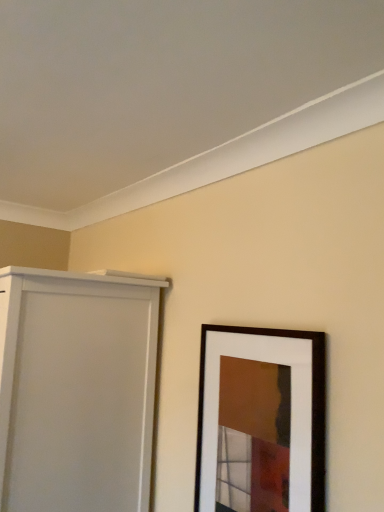
Find the location of a particular element. The height and width of the screenshot is (512, 384). white matte door at left is located at coordinates (76, 390).

The height and width of the screenshot is (512, 384). Describe the element at coordinates (76, 390) in the screenshot. I see `white matte door at left` at that location.

What are the coordinates of `wooden picture frame at lower right` in the screenshot? It's located at (261, 421).

In order to face wooden picture frame at lower right, should I rotate leftwards or rightwards?

A 7.708 degree turn to the right will do.

This screenshot has width=384, height=512. What do you see at coordinates (261, 421) in the screenshot?
I see `wooden picture frame at lower right` at bounding box center [261, 421].

Find the location of a particular element. This screenshot has width=384, height=512. white matte door at left is located at coordinates (76, 390).

Does white matte door at left appear on the left side of wooden picture frame at lower right?

Indeed, white matte door at left is positioned on the left side of wooden picture frame at lower right.

Is white matte door at left further to camera compared to wooden picture frame at lower right?

Yes, white matte door at left is further from the camera.

Considering the positions of points (57, 347) and (198, 508), is point (57, 347) closer to camera compared to point (198, 508)?

That is False.

From the image's perspective, which is below, white matte door at left or wooden picture frame at lower right?

white matte door at left, from the image's perspective.

From a real-world perspective, does white matte door at left sit lower than wooden picture frame at lower right?

Yes, from a real-world perspective, white matte door at left is under wooden picture frame at lower right.

Which of these two, white matte door at left or wooden picture frame at lower right, is wider?

white matte door at left is wider.

Is white matte door at left taller than wooden picture frame at lower right?

Yes.

Which of these two, white matte door at left or wooden picture frame at lower right, is bigger?

white matte door at left.

Is white matte door at left inside the boundaries of wooden picture frame at lower right, or outside?

white matte door at left is not enclosed by wooden picture frame at lower right.

Is white matte door at left touching wooden picture frame at lower right?

No, white matte door at left is not in contact with wooden picture frame at lower right.

Is white matte door at left facing away from wooden picture frame at lower right?

No, white matte door at left is not facing away from wooden picture frame at lower right.

From the picture: How distant is white matte door at left from wooden picture frame at lower right?

19.34 inches.

In the image, there is a wooden picture frame at lower right. At what (x,y) coordinates should I click in order to perform the action: click on door below it (from a real-world perspective). Please return your answer as a coordinate pair (x, y). Looking at the image, I should click on (76, 390).

Between wooden picture frame at lower right and white matte door at left, which one appears on the right side from the viewer's perspective?

wooden picture frame at lower right is more to the right.

Which is in front, wooden picture frame at lower right or white matte door at left?

wooden picture frame at lower right is in front.

Which point is more distant from viewer, (290, 484) or (82, 313)?

Positioned behind is point (82, 313).

From the image's perspective, relative to white matte door at left, is wooden picture frame at lower right above or below?

Based on their image positions, wooden picture frame at lower right is located above white matte door at left.

Based on the photo, from a real-world perspective, is wooden picture frame at lower right positioned above or below white matte door at left?

In terms of real-world spatial position, wooden picture frame at lower right is above white matte door at left.

Is wooden picture frame at lower right wider than white matte door at left?

No, wooden picture frame at lower right is not wider than white matte door at left.

Considering the sizes of wooden picture frame at lower right and white matte door at left in the image, is wooden picture frame at lower right taller or shorter than white matte door at left?

Considering their sizes, wooden picture frame at lower right has less height than white matte door at left.

Considering the sizes of objects wooden picture frame at lower right and white matte door at left in the image provided, who is smaller, wooden picture frame at lower right or white matte door at left?

wooden picture frame at lower right is smaller.

Is white matte door at left located within wooden picture frame at lower right?

Actually, white matte door at left is outside wooden picture frame at lower right.

Is wooden picture frame at lower right not close to white matte door at left?

No, wooden picture frame at lower right is in close proximity to white matte door at left.

From the picture: Is white matte door at left at the back of wooden picture frame at lower right?

No, wooden picture frame at lower right's orientation is not away from white matte door at left.

What's the angular difference between wooden picture frame at lower right and white matte door at left's facing directions?

wooden picture frame at lower right and white matte door at left are facing 0.258 degrees away from each other.

How much distance is there between wooden picture frame at lower right and white matte door at left?

A distance of 19.34 inches exists between wooden picture frame at lower right and white matte door at left.

Identify the location of picture frame to the right of white matte door at left. The width and height of the screenshot is (384, 512). (261, 421).

The height and width of the screenshot is (512, 384). Find the location of `door on the left of the wooden picture frame at lower right`. door on the left of the wooden picture frame at lower right is located at coordinates (76, 390).

Find the location of a particular element. This screenshot has width=384, height=512. picture frame above the white matte door at left (from a real-world perspective) is located at coordinates click(x=261, y=421).